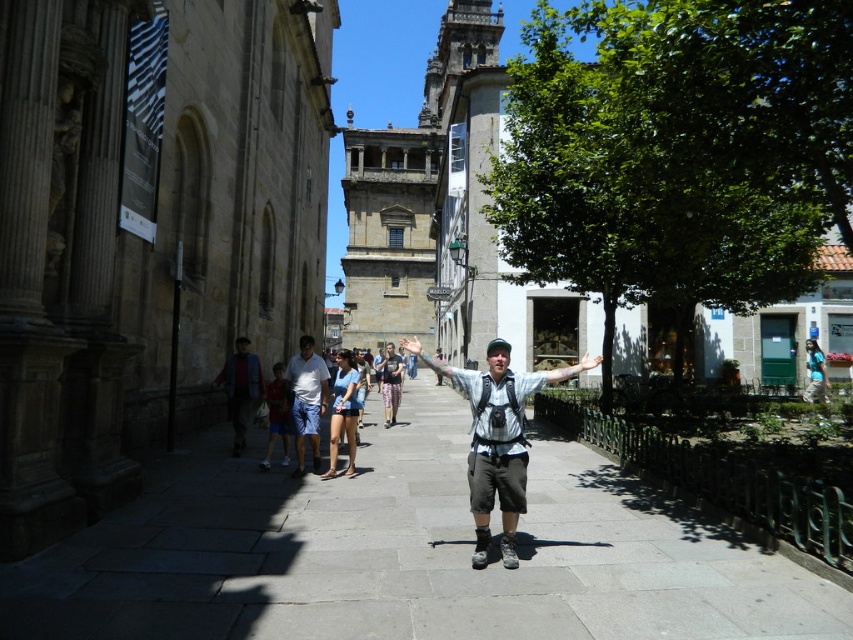
You are a photographer standing at the center of the street. You want to take a photo of the denim shorts at center but your camera is 58.06 meters away. Can you reach the camera to take the photo?

The denim shorts at center and camera are 58.06 meters apart from each other. Since the camera is 58.06 meters away from the denim shorts at center, you would need to move closer to the camera or the denim shorts to take the photo.

You are a photographer taking a picture of the man in the scene. You notice the denim shorts at center and the smooth skin hand at center. Which object should you focus on first if you want to capture the one that is more to the left?

The denim shorts at center is positioned on the left side of smooth skin hand at center, so you should focus on the denim shorts at center first to capture the one more to the left.

You are a photographer trying to capture the man in the scene. You notice the matte red shorts at center and the matte black hand at center. Which object is positioned lower in the image?

The matte red shorts at center is below the matte black hand at center, so the matte red shorts at center is positioned lower in the image.